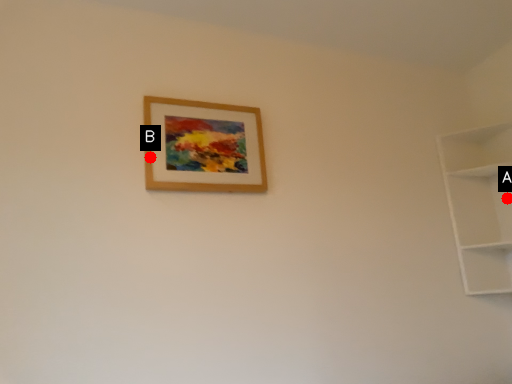
Question: Two points are circled on the image, labeled by A and B beside each circle. Which of the following is the closest to the observer?

Choices:
 (A) A is closer
 (B) B is closer

Answer: (B)